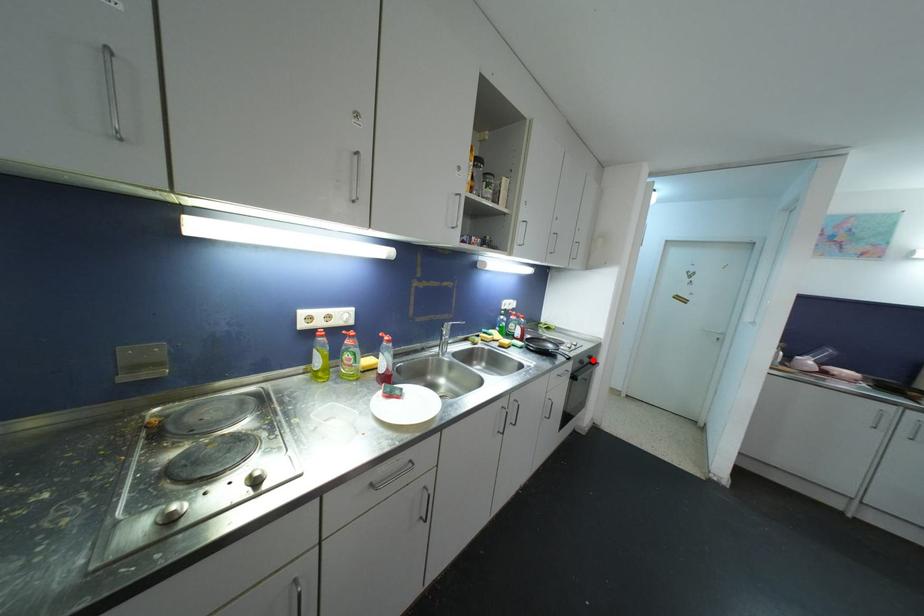
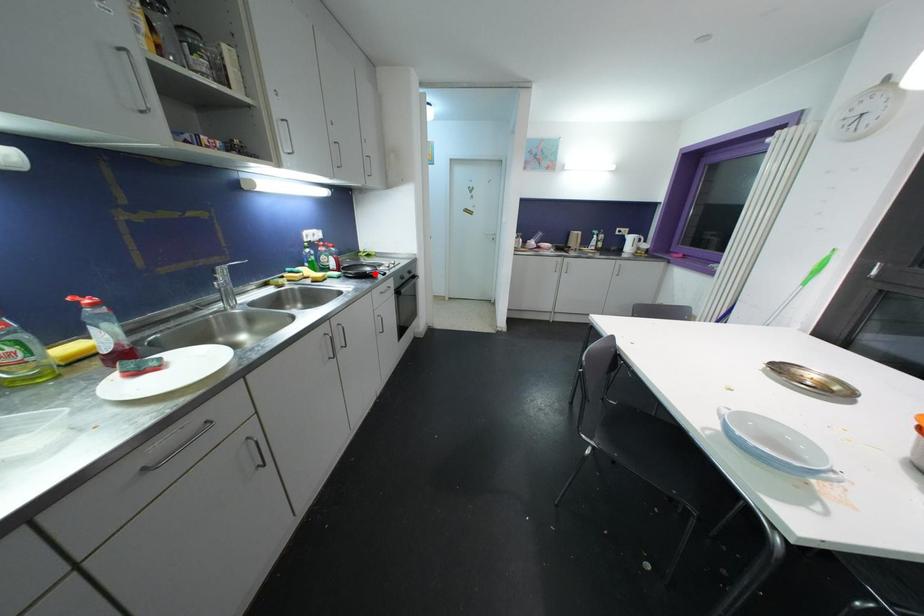
I am providing you with two images of the same scene from different viewpoints. A red point is marked on the first image and another point is marked on the second image. Do the highlighted points in image1 and image2 indicate the same real-world spot?

No